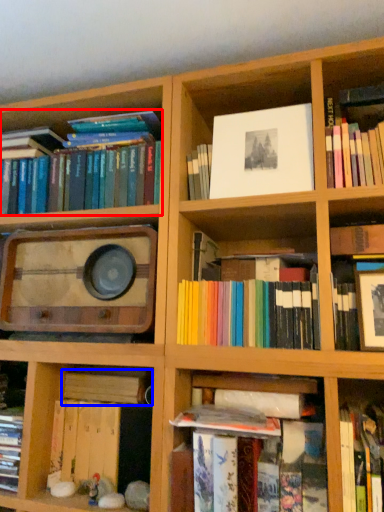
Question: Which point is further to the camera, book (highlighted by a red box) or book (highlighted by a blue box)?

Choices:
 (A) book
 (B) book

Answer: (A)